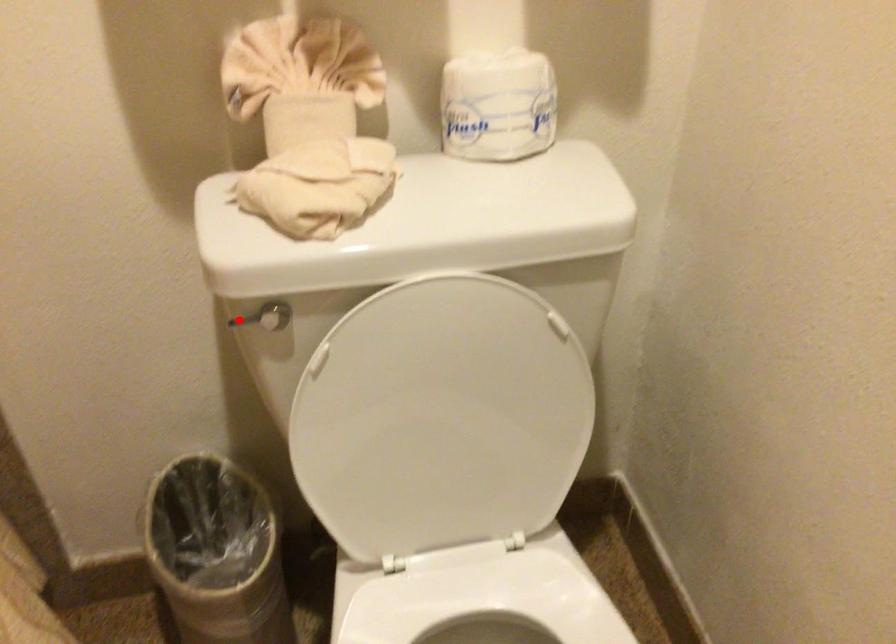
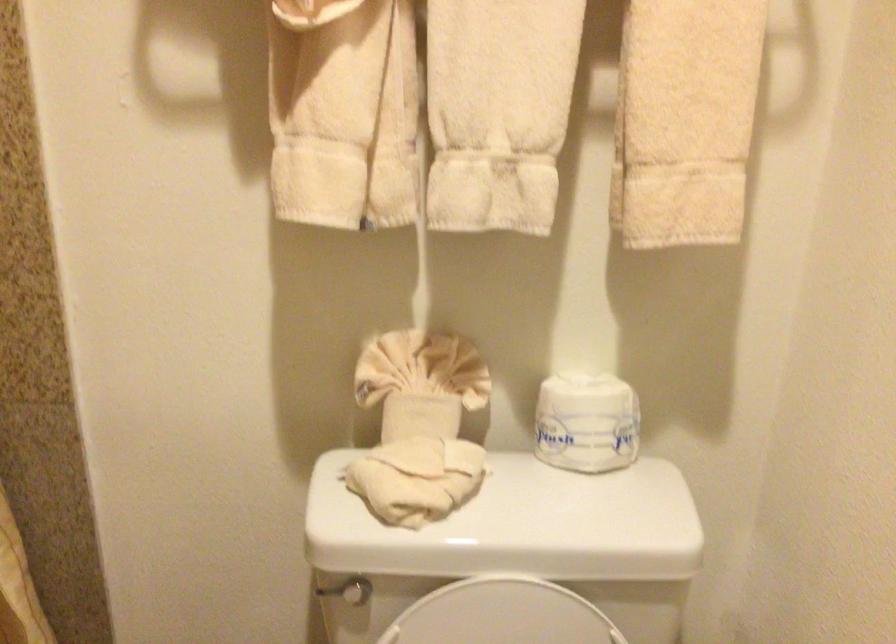
Question: I am providing you with two images of the same scene from different viewpoints. Image1 has a red point marked. In image2, the corresponding 3D location appears at what relative position? Reply with the corresponding letter.

Choices:
 (A) Closer
 (B) Farther

Answer: (B)